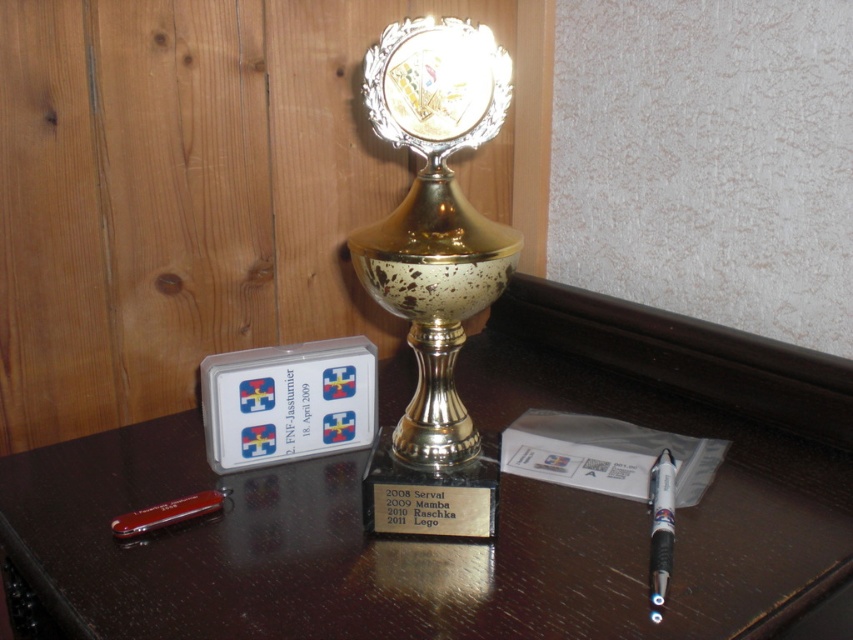
You are a photographer standing 1 meter away from a dark wooden table. You want to take a closeup photo of the gold polished trophy at center. Is the current distance sufficient to capture the trophy clearly in the frame without moving closer?

The gold polished trophy at center is 68.21 centimeters away from the viewer. Since you are standing 1 meter away, which is approximately 100 centimeters, the distance is sufficient to capture the trophy clearly without moving closer.

You are an event organizer who needs to place a new award plaque on the table. The plaque is 10 cm tall. The gold polished trophy at center is currently on the shiny dark wood table at center. Can the plaque be placed on the table without overlapping the trophy?

The shiny dark wood table at center is located below the gold polished trophy at center, but the description does not provide information about the size or space available on the table. Therefore, it is uncertain if the plaque can be placed without overlapping the trophy.

You are taking a photo of the trophy and want to focus on the part of the trophy that is closer to the camera. Which point should you focus on, point (457,260) or point (668,476)?

Point (457,260) is closer to the camera than point (668,476), so you should focus on point (457,260).